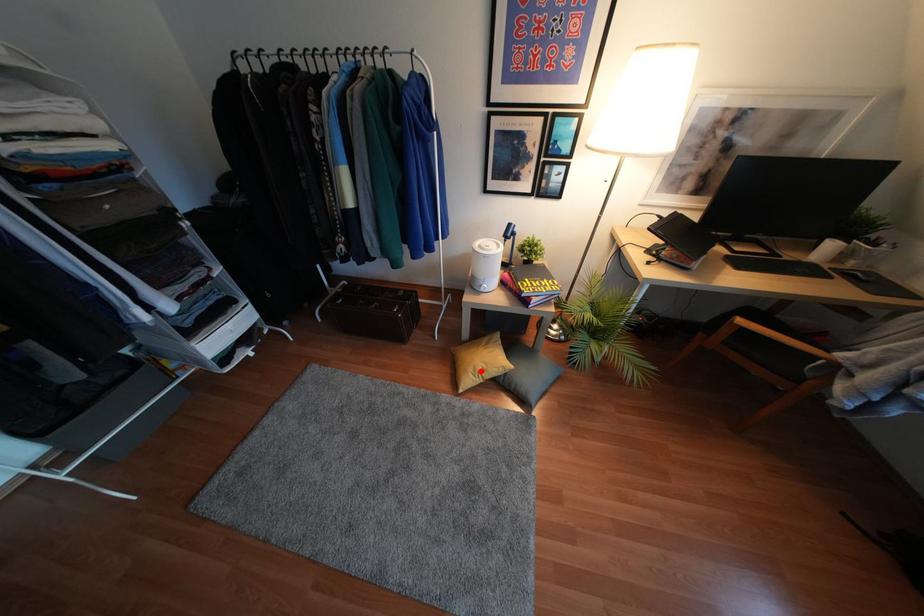
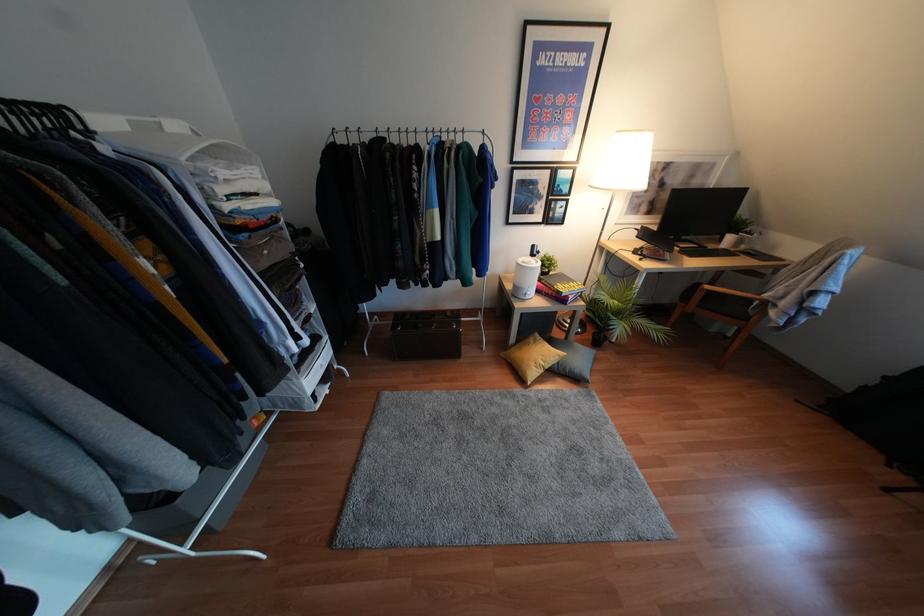
Find the pixel in the second image that matches the highlighted location in the first image.

(541, 363)